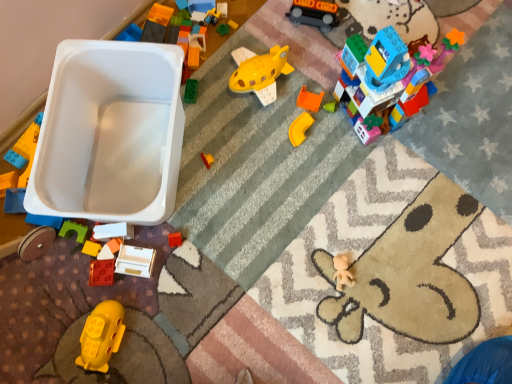
What are the coordinates of `vacant space to the right of shiny black train at upper center, which ranks as the 2th toy in right-to-left order` in the screenshot? It's located at (359, 18).